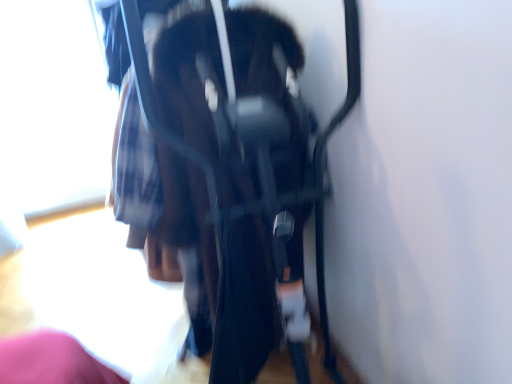
This screenshot has width=512, height=384. What do you see at coordinates (230, 176) in the screenshot?
I see `matte black chair at center` at bounding box center [230, 176].

At what (x,y) coordinates should I click in order to perform the action: click on matte black chair at center. Please return your answer as a coordinate pair (x, y). The image size is (512, 384). Looking at the image, I should click on (230, 176).

Where is `matte black chair at center`? matte black chair at center is located at coordinates (230, 176).